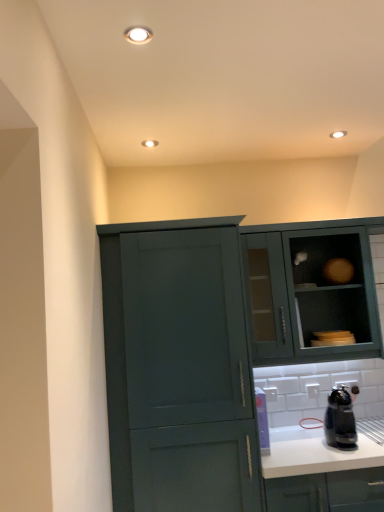
Question: Is matte teal cabinet at center-left, arranged as the 1th cabinetry when viewed from the left, to the left or to the right of matte teal cabinet at upper right, the second cabinetry positioned from the left, in the image?

Choices:
 (A) right
 (B) left

Answer: (B)

Question: Is point (211, 227) closer or farther from the camera than point (269, 249)?

Choices:
 (A) closer
 (B) farther

Answer: (A)

Question: Which is nearer to the matte teal cabinet at upper right, arranged as the 1th cabinetry when viewed from the right?

Choices:
 (A) matte teal cabinet at center-left, which is the second cabinetry from right to left
 (B) white matte countertop at lower right
 (C) black plastic coffee maker at lower right

Answer: (C)

Question: Estimate the real-world distances between objects in this image. Which object is closer to the matte teal cabinet at upper right, the second cabinetry positioned from the left?

Choices:
 (A) black plastic coffee maker at lower right
 (B) white matte countertop at lower right
 (C) matte teal cabinet at center-left, arranged as the 1th cabinetry when viewed from the left

Answer: (A)